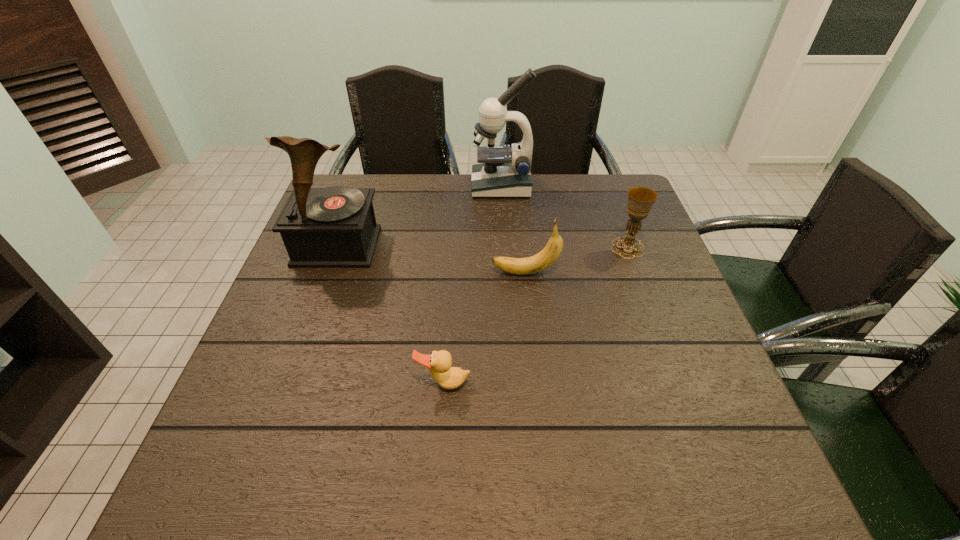
The width and height of the screenshot is (960, 540). Find the location of `vacant space at the left edge of the desktop`. vacant space at the left edge of the desktop is located at coordinates (292, 315).

This screenshot has height=540, width=960. Identify the location of free space at the right edge. (650, 264).

Identify the location of vacant space at the near left corner. (271, 457).

Identify the location of free space at the far right corner of the desktop. (582, 183).

Locate an element on the screen. Image resolution: width=960 pixels, height=540 pixels. vacant area between the banana and the farthest object is located at coordinates (514, 229).

Find the location of `free spot between the banana and the nearest object`. free spot between the banana and the nearest object is located at coordinates (485, 328).

Locate an element on the screen. The width and height of the screenshot is (960, 540). vacant space that's between the nearest object and the leftmost object is located at coordinates (391, 315).

You are a GUI agent. You are given a task and a screenshot of the screen. Output one action in this format:
    pyautogui.click(x=<x>, y=<y>)
    Task: Click on the vacant space that's between the nearest object and the chalice
    
    Given the screenshot: What is the action you would take?
    pyautogui.click(x=536, y=315)

The width and height of the screenshot is (960, 540). I want to click on empty space between the microscope and the rightmost object, so click(564, 217).

This screenshot has height=540, width=960. What are the coordinates of `free space between the farthest object and the phonograph_record` in the screenshot? It's located at click(420, 216).